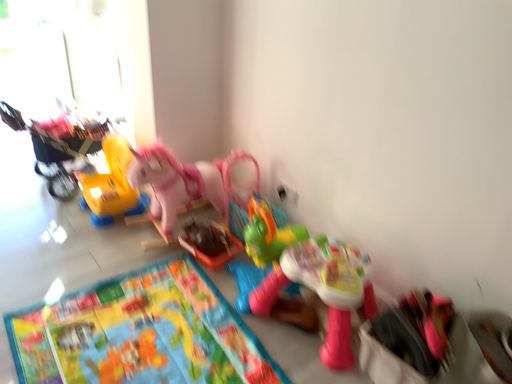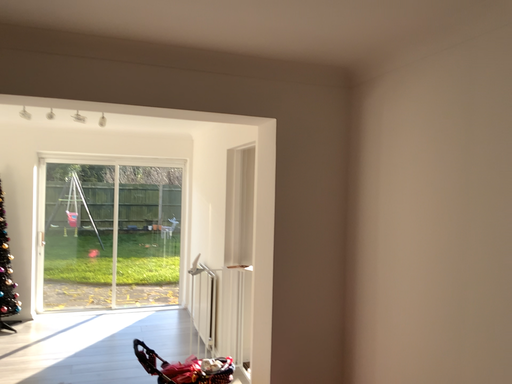
Question: How did the camera likely rotate when shooting the video?

Choices:
 (A) rotated left
 (B) rotated right

Answer: (A)